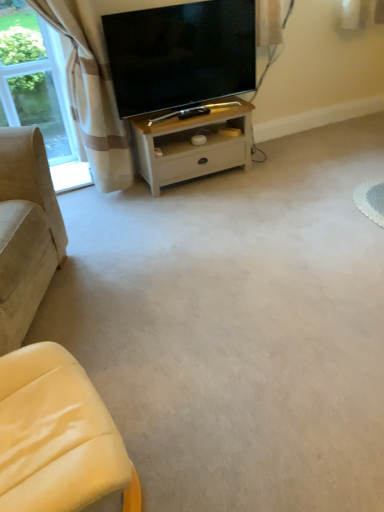
Question: Can beige corduroy couch at left, arranged as the 2th studio couch when viewed from the right, be found inside beige plaid curtain at upper left?

Choices:
 (A) no
 (B) yes

Answer: (A)

Question: From the image's perspective, would you say beige plaid curtain at upper left is positioned over beige corduroy couch at left, arranged as the 2th studio couch when viewed from the right?

Choices:
 (A) yes
 (B) no

Answer: (A)

Question: Does beige plaid curtain at upper left appear on the left side of beige corduroy couch at left, arranged as the 2th studio couch when viewed from the right?

Choices:
 (A) yes
 (B) no

Answer: (B)

Question: From the image's perspective, would you say beige plaid curtain at upper left is shown under beige corduroy couch at left, positioned as the 1th studio couch in left-to-right order?

Choices:
 (A) no
 (B) yes

Answer: (A)

Question: Can you confirm if beige plaid curtain at upper left is smaller than beige corduroy couch at left, positioned as the 1th studio couch in left-to-right order?

Choices:
 (A) no
 (B) yes

Answer: (B)

Question: Can you confirm if beige plaid curtain at upper left is taller than beige corduroy couch at left, arranged as the 2th studio couch when viewed from the right?

Choices:
 (A) yes
 (B) no

Answer: (A)

Question: Can you confirm if clear glass window at upper left is taller than matte black tv at upper center?

Choices:
 (A) no
 (B) yes

Answer: (B)

Question: Does clear glass window at upper left have a larger size compared to matte black tv at upper center?

Choices:
 (A) yes
 (B) no

Answer: (B)

Question: Is matte black tv at upper center at the back of clear glass window at upper left?

Choices:
 (A) yes
 (B) no

Answer: (B)

Question: Is clear glass window at upper left surrounding matte black tv at upper center?

Choices:
 (A) yes
 (B) no

Answer: (B)

Question: From a real-world perspective, is clear glass window at upper left positioned under matte black tv at upper center based on gravity?

Choices:
 (A) no
 (B) yes

Answer: (B)

Question: From the image's perspective, does clear glass window at upper left appear higher than matte black tv at upper center?

Choices:
 (A) yes
 (B) no

Answer: (B)

Question: Is matte black tv at upper center wider than clear glass window at upper left?

Choices:
 (A) no
 (B) yes

Answer: (B)